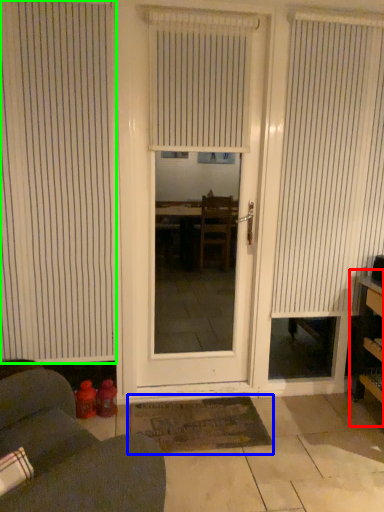
Question: Based on their relative distances, which object is nearer to bookshelf (highlighted by a red box)? Choose from doormat (highlighted by a blue box) and window blind (highlighted by a green box).

Choices:
 (A) doormat
 (B) window blind

Answer: (A)